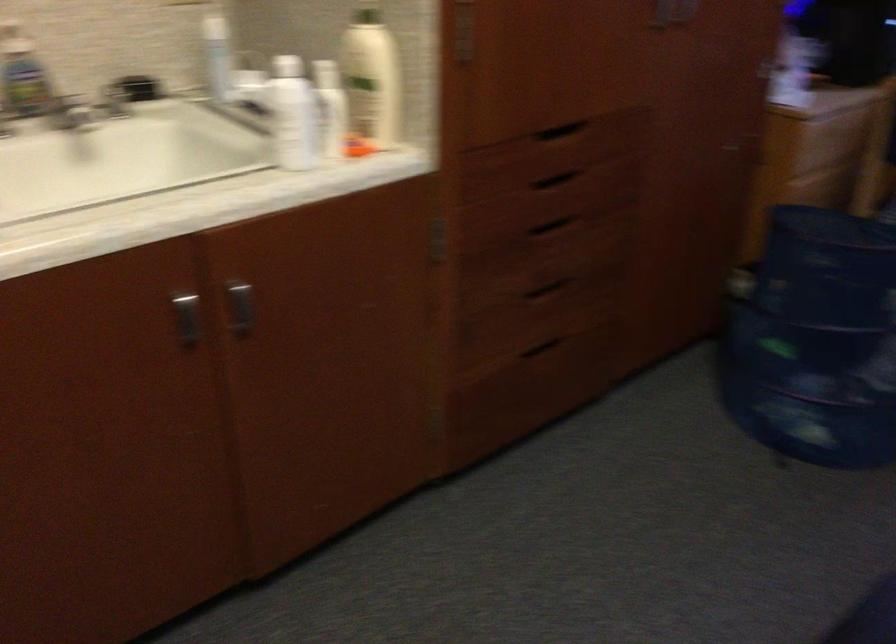
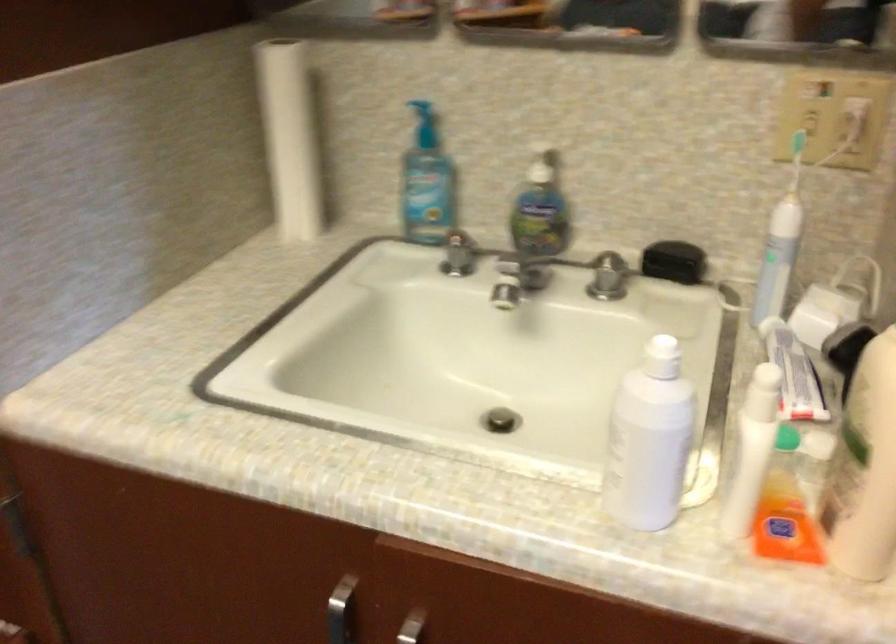
The point at (183,304) is marked in the first image. Where is the corresponding point in the second image?

(340, 611)